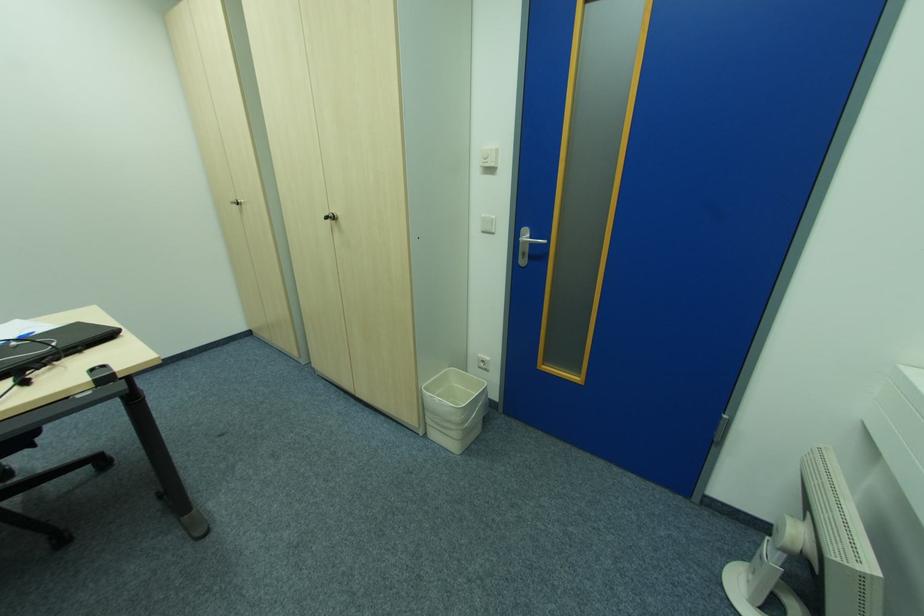
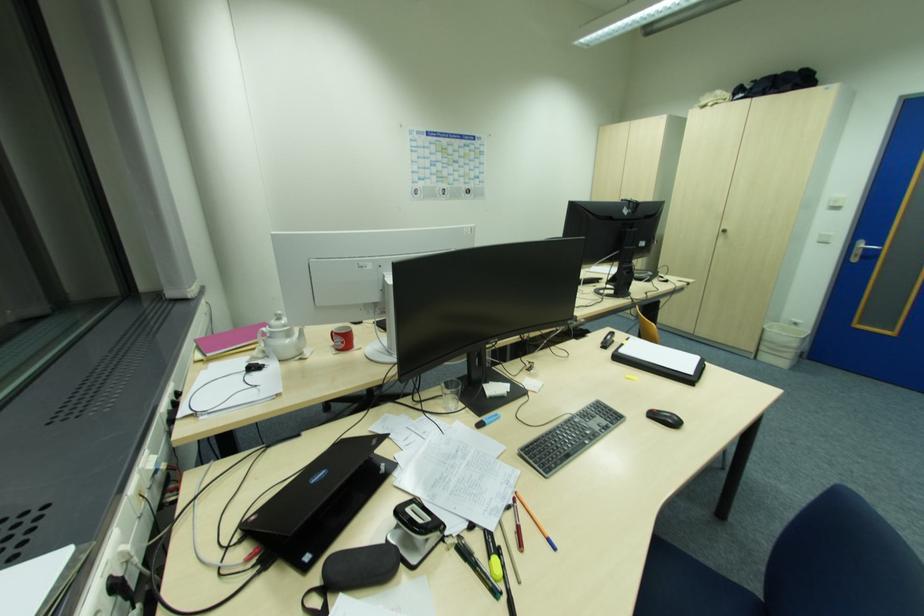
The images are taken continuously from a first-person perspective. In which direction are you moving?

The cameraman moved toward left, backward.